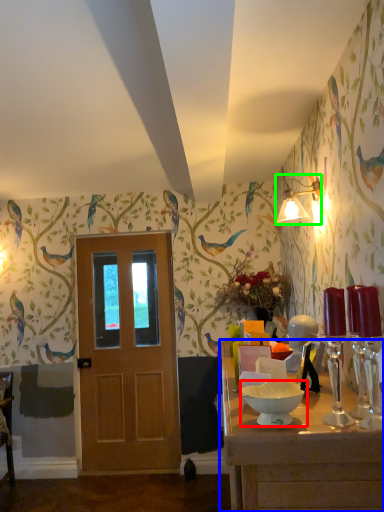
Question: Which object is the closest to the bowl (highlighted by a red box)? Choose among these: table (highlighted by a blue box) or light fixture (highlighted by a green box).

Choices:
 (A) table
 (B) light fixture

Answer: (A)